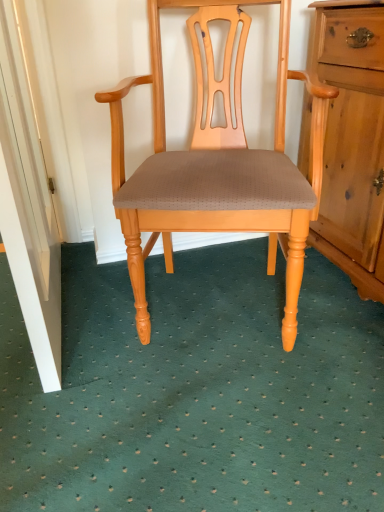
The height and width of the screenshot is (512, 384). I want to click on vacant space underneath light wood/finely carvedchair at center (from a real-world perspective), so click(220, 327).